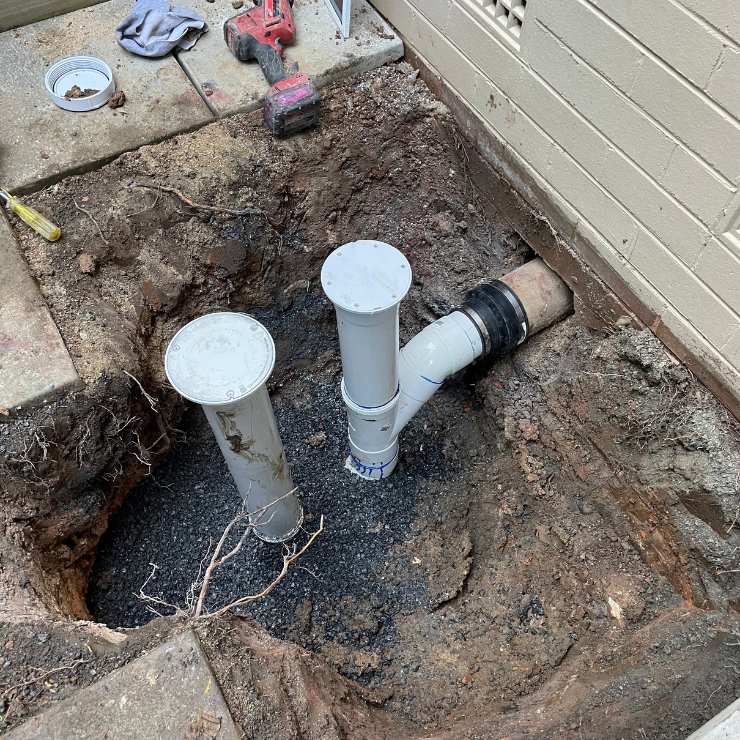
Locate an element on the screen. white circular round container is located at coordinates (80, 69).